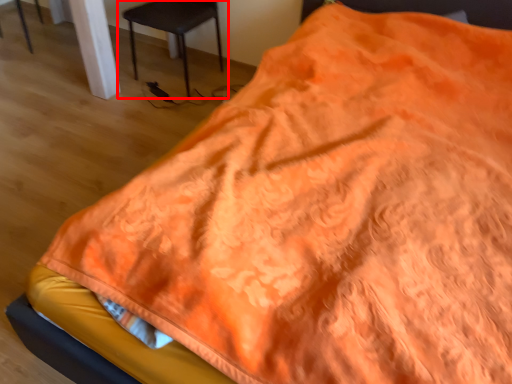
Question: From the image's perspective, what is the correct spatial positioning of chair (annotated by the red box) in reference to chair?

Choices:
 (A) above
 (B) below

Answer: (B)